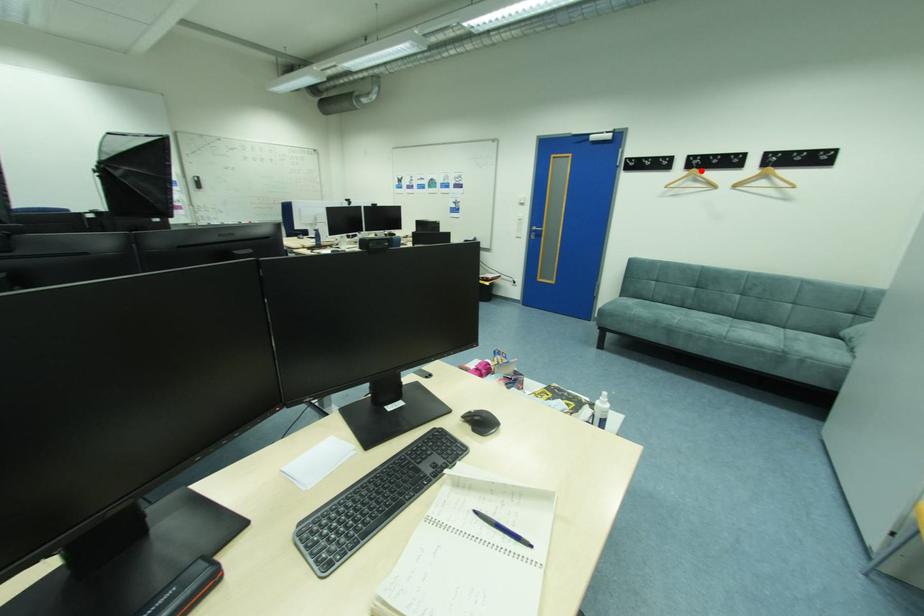
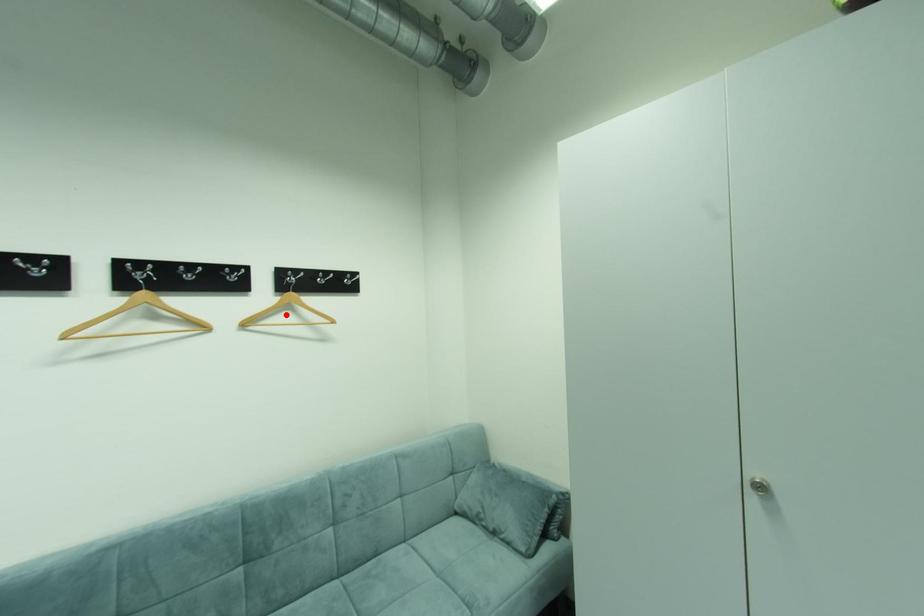
I am providing you with two images of the same scene from different viewpoints. A red point is marked on the first image and another point is marked on the second image. Are the points marked in image1 and image2 representing the same 3D position?

No